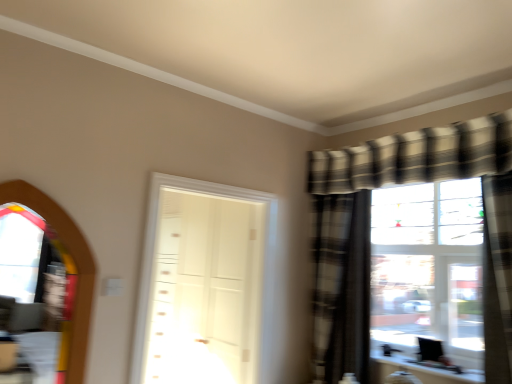
Measure the distance between point (321, 255) and camera.

They are 9.56 feet apart.

You are a GUI agent. You are given a task and a screenshot of the screen. Output one action in this format:
    pyautogui.click(x=<x>, y=<y>)
    Task: Click on the plaid fabric curtain at right, which is the first curtain in left-to-right order
    
    Given the screenshot: What is the action you would take?
    pyautogui.click(x=341, y=286)

Locate an element on the screen. The image size is (512, 384). transparent glass window screen at left is located at coordinates (74, 261).

Where is `plaid fabric curtain at right, the second curtain viewed from the left`? The height and width of the screenshot is (384, 512). plaid fabric curtain at right, the second curtain viewed from the left is located at coordinates (497, 278).

Is transparent glass window screen at left not close to plaid fabric curtain at right, which appears as the second curtain when viewed from the back?

Indeed, transparent glass window screen at left is not near plaid fabric curtain at right, which appears as the second curtain when viewed from the back.

Between transparent glass window screen at left and plaid fabric curtain at right, the first curtain from the front, which one is positioned behind?

plaid fabric curtain at right, the first curtain from the front, is behind.

Can you confirm if transparent glass window screen at left is bigger than plaid fabric curtain at right, the first curtain from the front?

Incorrect, transparent glass window screen at left is not larger than plaid fabric curtain at right, the first curtain from the front.

How far apart are transparent glass window screen at left and plaid fabric curtain at right, placed as the first curtain when sorted from right to left?

transparent glass window screen at left and plaid fabric curtain at right, placed as the first curtain when sorted from right to left, are 2.01 meters apart from each other.

In terms of size, does white glossy door at center appear bigger or smaller than transparent glass window screen at left?

white glossy door at center is bigger than transparent glass window screen at left.

Identify the location of door below the transparent glass window screen at left (from the image's perspective). The height and width of the screenshot is (384, 512). (206, 285).

Which is more to the left, white glossy door at center or transparent glass window screen at left?

From the viewer's perspective, transparent glass window screen at left appears more on the left side.

Is plaid fabric curtain at right, placed as the first curtain when sorted from right to left, inside or outside of transparent glass window screen at left?

plaid fabric curtain at right, placed as the first curtain when sorted from right to left, lies outside transparent glass window screen at left.

Does plaid fabric curtain at right, placed as the first curtain when sorted from right to left, have a greater height compared to transparent glass window screen at left?

Yes.

In the image, is plaid fabric curtain at right, the first curtain from the front, on the left side or the right side of transparent glass window screen at left?

From the image, it's evident that plaid fabric curtain at right, the first curtain from the front, is to the right of transparent glass window screen at left.

Is transparent glass window screen at left situated inside plaid fabric curtain at right, which is the first curtain in left-to-right order, or outside?

transparent glass window screen at left is not enclosed by plaid fabric curtain at right, which is the first curtain in left-to-right order.

Which is in front, transparent glass window screen at left or plaid fabric curtain at right, the 2th curtain viewed from the front?

transparent glass window screen at left is more forward.

Considering the sizes of objects transparent glass window screen at left and plaid fabric curtain at right, which is the first curtain in left-to-right order, in the image provided, who is wider, transparent glass window screen at left or plaid fabric curtain at right, which is the first curtain in left-to-right order,?

plaid fabric curtain at right, which is the first curtain in left-to-right order.

From the image's perspective, would you say transparent glass window screen at left is shown under plaid fabric curtain at right, the 2th curtain viewed from the right?

No.

From a real-world perspective, which is physically below, white glossy door at center or plaid fabric curtain at right, which appears as the second curtain when viewed from the back?

white glossy door at center is physically lower.

Which is correct: white glossy door at center is inside plaid fabric curtain at right, which appears as the second curtain when viewed from the back, or outside of it?

white glossy door at center cannot be found inside plaid fabric curtain at right, which appears as the second curtain when viewed from the back.

Which object is closer to the camera taking this photo, white glossy door at center or plaid fabric curtain at right, which appears as the second curtain when viewed from the back?

plaid fabric curtain at right, which appears as the second curtain when viewed from the back, is closer to the camera.

How different are the orientations of white glossy door at center and plaid fabric curtain at right, the second curtain viewed from the left, in degrees?

There is a 86.3-degree angle between the facing directions of white glossy door at center and plaid fabric curtain at right, the second curtain viewed from the left.

Would you say plaid fabric curtain at right, which is the first curtain in left-to-right order, is part of plaid fabric curtain at right, the first curtain from the front,'s contents?

No, plaid fabric curtain at right, which is the first curtain in left-to-right order, is not inside plaid fabric curtain at right, the first curtain from the front.

The image size is (512, 384). What are the coordinates of `curtain above the plaid fabric curtain at right, arranged as the 1th curtain when viewed from the back (from the image's perspective)` in the screenshot? It's located at (497, 278).

Considering the relative sizes of plaid fabric curtain at right, the first curtain from the front, and plaid fabric curtain at right, the 2th curtain viewed from the front, in the image provided, is plaid fabric curtain at right, the first curtain from the front, thinner than plaid fabric curtain at right, the 2th curtain viewed from the front,?

In fact, plaid fabric curtain at right, the first curtain from the front, might be wider than plaid fabric curtain at right, the 2th curtain viewed from the front.

Is plaid fabric curtain at right, the 2th curtain viewed from the front, at the back of plaid fabric curtain at right, placed as the first curtain when sorted from right to left?

No, plaid fabric curtain at right, placed as the first curtain when sorted from right to left, is not facing the opposite direction of plaid fabric curtain at right, the 2th curtain viewed from the front.

Considering the positions of objects plaid fabric curtain at right, arranged as the 1th curtain when viewed from the back, and plaid fabric curtain at right, the first curtain from the front, in the image provided, who is more to the right, plaid fabric curtain at right, arranged as the 1th curtain when viewed from the back, or plaid fabric curtain at right, the first curtain from the front,?

Positioned to the right is plaid fabric curtain at right, the first curtain from the front.

Who is more distant, plaid fabric curtain at right, the 2th curtain viewed from the right, or plaid fabric curtain at right, which appears as the second curtain when viewed from the back?

Positioned behind is plaid fabric curtain at right, the 2th curtain viewed from the right.

Is plaid fabric curtain at right, the 2th curtain viewed from the right, far from plaid fabric curtain at right, which appears as the second curtain when viewed from the back?

plaid fabric curtain at right, the 2th curtain viewed from the right, is near plaid fabric curtain at right, which appears as the second curtain when viewed from the back, not far away.

Is plaid fabric curtain at right, arranged as the 1th curtain when viewed from the back, located outside plaid fabric curtain at right, the second curtain viewed from the left?

Yes, plaid fabric curtain at right, arranged as the 1th curtain when viewed from the back, is outside of plaid fabric curtain at right, the second curtain viewed from the left.

Identify the location of curtain that is the 2nd one above the transparent glass window screen at left (from a real-world perspective). (497, 278).

I want to click on window screen that is above the white glossy door at center (from the image's perspective), so click(x=74, y=261).

Which object lies further to the anchor point white glossy door at center, plaid fabric curtain at right, the second curtain viewed from the left, or plaid fabric curtain at right, which is the first curtain in left-to-right order?

plaid fabric curtain at right, the second curtain viewed from the left, is positioned further to the anchor white glossy door at center.

Which object lies further to the anchor point white glossy door at center, plaid fabric curtain at right, the 2th curtain viewed from the right, or plaid fabric curtain at right, which appears as the second curtain when viewed from the back?

Among the two, plaid fabric curtain at right, which appears as the second curtain when viewed from the back, is located further to white glossy door at center.

Estimate the real-world distances between objects in this image. Which object is further from transparent glass window screen at left, plaid fabric curtain at right, which appears as the second curtain when viewed from the back, or white glossy door at center?

plaid fabric curtain at right, which appears as the second curtain when viewed from the back, lies further to transparent glass window screen at left than the other object.

Based on their spatial positions, is transparent glass window screen at left or white glossy door at center further from plaid fabric curtain at right, arranged as the 1th curtain when viewed from the back?

Based on the image, transparent glass window screen at left appears to be further to plaid fabric curtain at right, arranged as the 1th curtain when viewed from the back.

Based on their spatial positions, is plaid fabric curtain at right, the first curtain from the front, or plaid fabric curtain at right, which is the first curtain in left-to-right order, closer to transparent glass window screen at left?

Based on the image, plaid fabric curtain at right, which is the first curtain in left-to-right order, appears to be nearer to transparent glass window screen at left.

From the image, which object appears to be farther from plaid fabric curtain at right, which is the first curtain in left-to-right order, plaid fabric curtain at right, which appears as the second curtain when viewed from the back, or transparent glass window screen at left?

transparent glass window screen at left lies further to plaid fabric curtain at right, which is the first curtain in left-to-right order, than the other object.

Considering their positions, is white glossy door at center positioned further to transparent glass window screen at left than plaid fabric curtain at right, the second curtain viewed from the left?

plaid fabric curtain at right, the second curtain viewed from the left.

Looking at the image, which one is located closer to white glossy door at center, transparent glass window screen at left or plaid fabric curtain at right, the 2th curtain viewed from the right?

The object closer to white glossy door at center is plaid fabric curtain at right, the 2th curtain viewed from the right.

This screenshot has width=512, height=384. Find the location of `curtain located between white glossy door at center and plaid fabric curtain at right, which appears as the second curtain when viewed from the back, in the left-right direction`. curtain located between white glossy door at center and plaid fabric curtain at right, which appears as the second curtain when viewed from the back, in the left-right direction is located at coordinates (341, 286).

At what (x,y) coordinates should I click in order to perform the action: click on door between transparent glass window screen at left and plaid fabric curtain at right, the second curtain viewed from the left, from left to right. Please return your answer as a coordinate pair (x, y). Looking at the image, I should click on (206, 285).

The height and width of the screenshot is (384, 512). I want to click on door between transparent glass window screen at left and plaid fabric curtain at right, the 2th curtain viewed from the front, in the horizontal direction, so click(206, 285).

At what (x,y) coordinates should I click in order to perform the action: click on curtain situated between transparent glass window screen at left and plaid fabric curtain at right, placed as the first curtain when sorted from right to left, from left to right. Please return your answer as a coordinate pair (x, y). The height and width of the screenshot is (384, 512). Looking at the image, I should click on (341, 286).